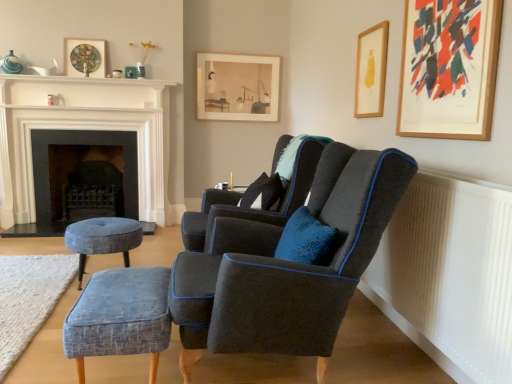
Find the location of a particular element. This screenshot has width=512, height=384. empty space that is ontop of textured blue ottoman at lower left (from a real-world perspective) is located at coordinates (28, 277).